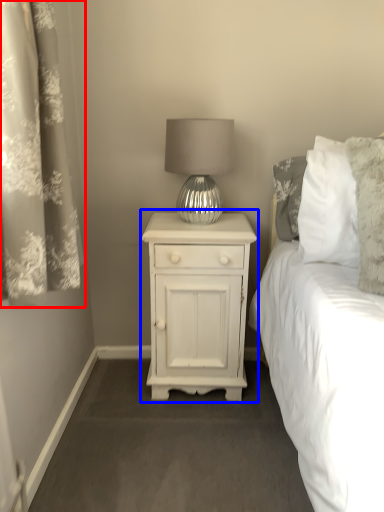
Question: Which of the following is the closest to the observer, curtain (highlighted by a red box) or nightstand (highlighted by a blue box)?

Choices:
 (A) curtain
 (B) nightstand

Answer: (A)